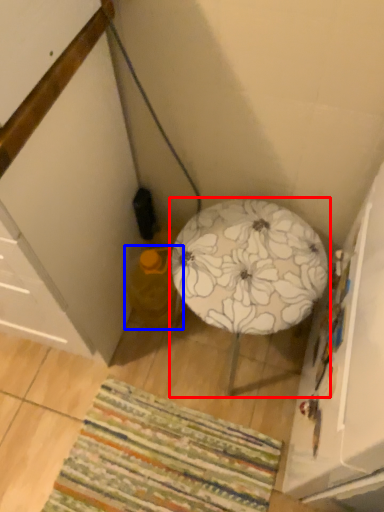
Question: Which of the following is the closest to the observer, furniture (highlighted by a red box) or bean bag chair (highlighted by a blue box)?

Choices:
 (A) furniture
 (B) bean bag chair

Answer: (A)